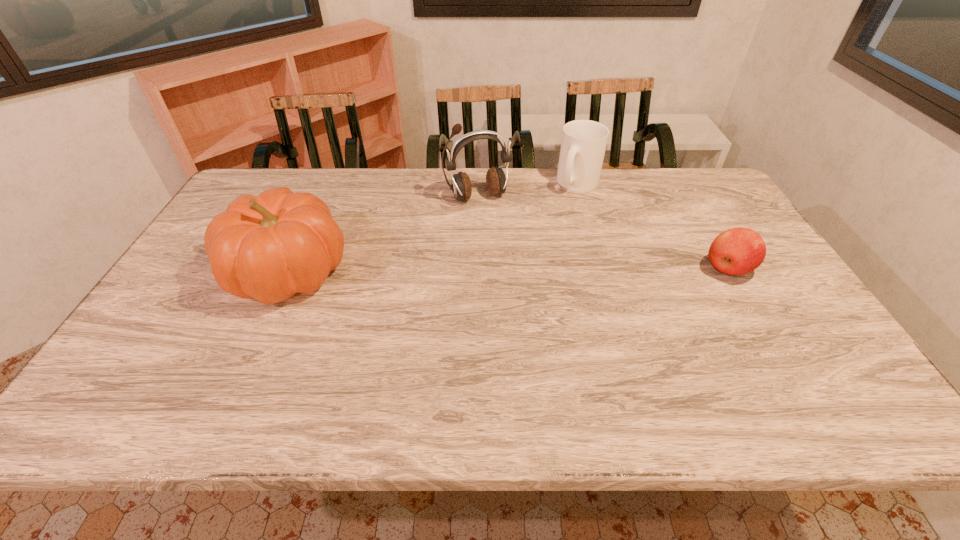
This screenshot has height=540, width=960. I want to click on vacant area situated on the ear pads of the second object from left to right, so click(518, 271).

Identify the location of blank area located 0.220m on the handle side of the second shortest object. The width and height of the screenshot is (960, 540). (557, 234).

Identify the location of vacant space situated on the handle side of the second shortest object. (561, 227).

You are a GUI agent. You are given a task and a screenshot of the screen. Output one action in this format:
    pyautogui.click(x=<x>, y=<y>)
    Task: Click on the vacant space located 0.190m on the handle side of the second shortest object
    This screenshot has width=960, height=540.
    Given the screenshot: What is the action you would take?
    pyautogui.click(x=560, y=229)

Where is `earphone that is positioned at the far edge`? earphone that is positioned at the far edge is located at coordinates (496, 181).

Locate an element on the screen. The width and height of the screenshot is (960, 540). mug positioned at the far edge is located at coordinates (583, 145).

The image size is (960, 540). I want to click on object that is at the left edge, so click(269, 247).

Image resolution: width=960 pixels, height=540 pixels. In order to click on object at the right edge in this screenshot , I will do `click(737, 251)`.

This screenshot has width=960, height=540. I want to click on vacant area at the far edge of the desktop, so click(354, 200).

I want to click on vacant space at the near edge, so click(x=590, y=348).